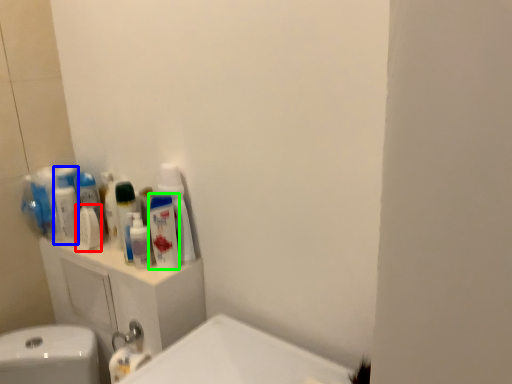
Question: Based on their relative distances, which object is nearer to mouthwash (highlighted by a red box)? Choose from mouthwash (highlighted by a blue box) and mouthwash (highlighted by a green box).

Choices:
 (A) mouthwash
 (B) mouthwash

Answer: (A)